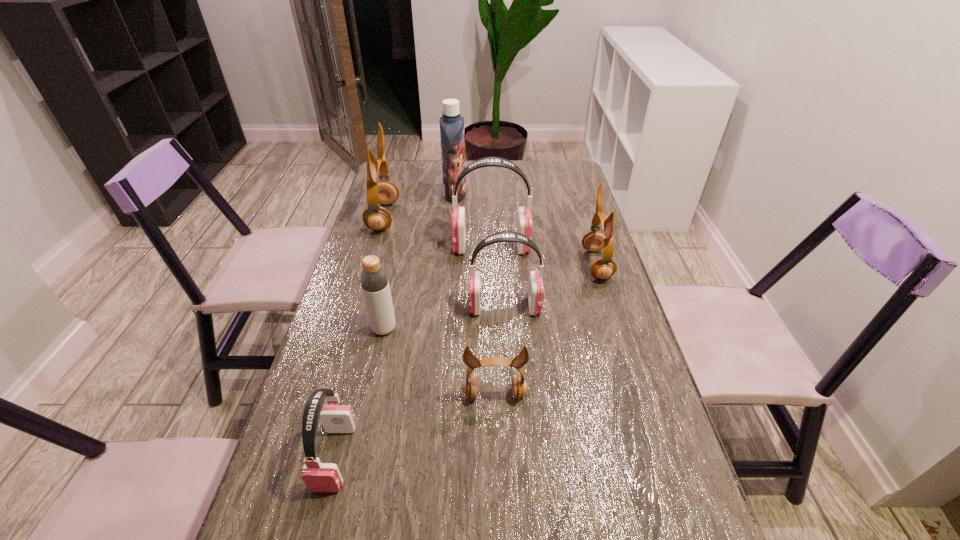
The image size is (960, 540). What are the coordinates of `blue shampoo` in the screenshot? It's located at (451, 123).

Locate an element on the screen. the farthest brown earphone is located at coordinates [x=375, y=217].

Identify the location of the leftmost brown earphone. (375, 217).

Locate an element on the screen. The width and height of the screenshot is (960, 540). the biggest pink earphone is located at coordinates (524, 220).

This screenshot has height=540, width=960. In order to click on the second smallest brown earphone in this screenshot , I will do `click(595, 240)`.

Where is `the rightmost brown earphone`? The width and height of the screenshot is (960, 540). the rightmost brown earphone is located at coordinates (595, 240).

At what (x,y) coordinates should I click in order to perform the action: click on the second farthest pink earphone. Please return your answer as a coordinate pair (x, y). Looking at the image, I should click on (535, 288).

This screenshot has width=960, height=540. I want to click on the second smallest pink earphone, so click(535, 288).

Image resolution: width=960 pixels, height=540 pixels. I want to click on the sixth farthest object, so click(374, 281).

Find the location of a particular element. gray bottle is located at coordinates (374, 281).